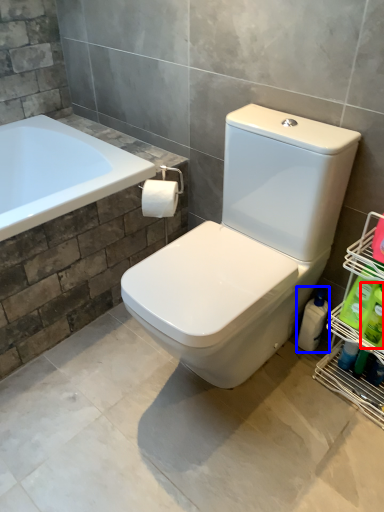
Question: Among these objects, which one is farthest to the camera, cleaning product (highlighted by a red box) or cleaning product (highlighted by a blue box)?

Choices:
 (A) cleaning product
 (B) cleaning product

Answer: (B)